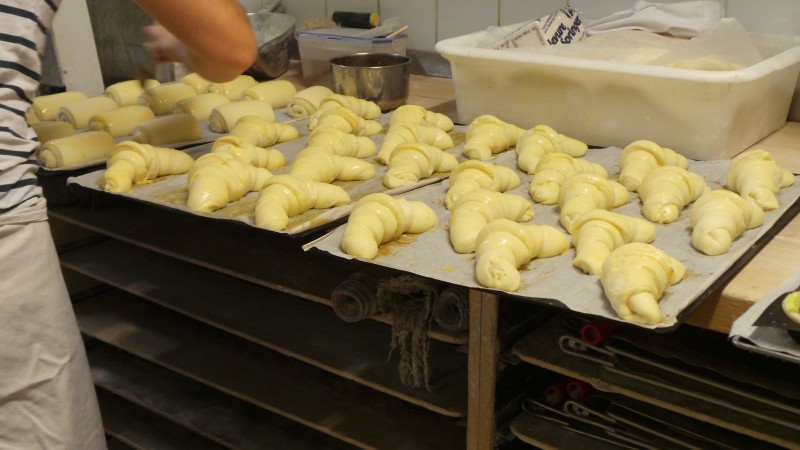
This screenshot has height=450, width=800. I want to click on shelves under the tabletop, so click(210, 265), click(200, 316), click(181, 372), click(158, 411), click(134, 439), click(646, 396), click(536, 434).